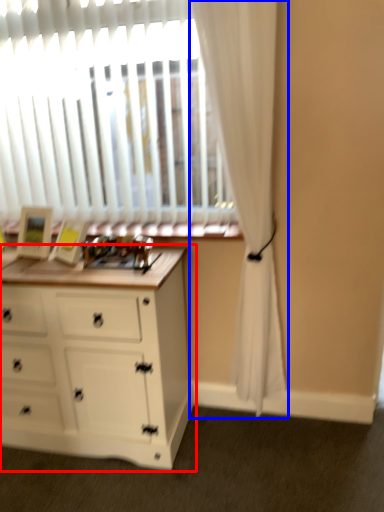
Question: Which of the following is the closest to the observer, chest of drawers (highlighted by a red box) or curtain (highlighted by a blue box)?

Choices:
 (A) chest of drawers
 (B) curtain

Answer: (B)